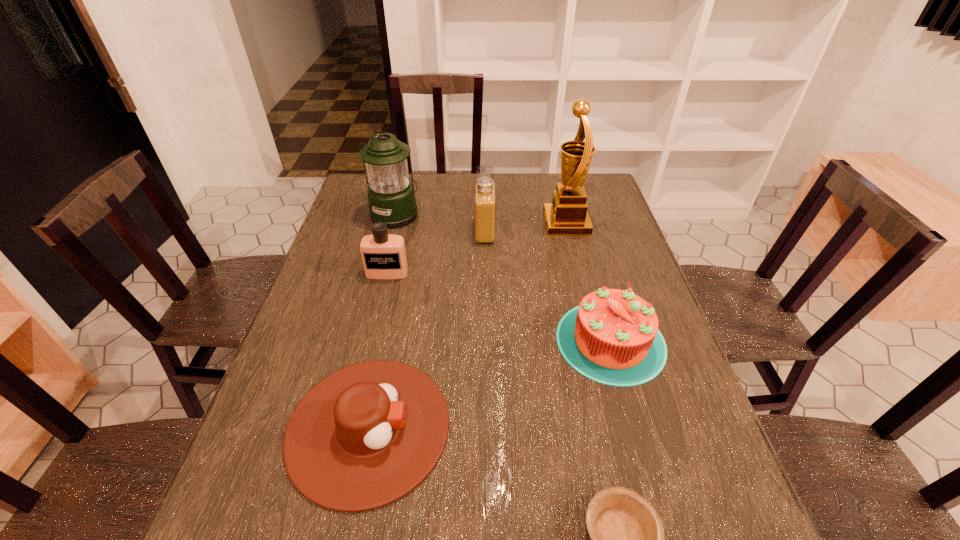
Where is `blank space located on the front-facing side of the tallest object`? This screenshot has height=540, width=960. blank space located on the front-facing side of the tallest object is located at coordinates (438, 223).

The width and height of the screenshot is (960, 540). Identify the location of free space located on the back of the second tallest object. (405, 176).

Where is `free space located on the front-facing side of the taller perfume`? This screenshot has width=960, height=540. free space located on the front-facing side of the taller perfume is located at coordinates (356, 231).

You are a GUI agent. You are given a task and a screenshot of the screen. Output one action in this format:
    pyautogui.click(x=<x>, y=<y>)
    Task: Click on the free spot located 0.300m on the front-facing side of the taller perfume
    
    Given the screenshot: What is the action you would take?
    pyautogui.click(x=381, y=231)

Find the location of a particular element. The width and height of the screenshot is (960, 540). free space located 0.380m on the front-facing side of the taller perfume is located at coordinates (356, 231).

At what (x,y) coordinates should I click in order to perform the action: click on vacant space situated on the front label of the shorter perfume. Please return your answer as a coordinate pair (x, y). The width and height of the screenshot is (960, 540). Looking at the image, I should click on (368, 357).

The height and width of the screenshot is (540, 960). In order to click on free space located 0.370m on the back of the cake in this screenshot , I will do `click(577, 222)`.

Identify the location of free space located 0.340m on the front-facing side of the sixth tallest object. This screenshot has width=960, height=540. coord(614,428).

Locate an element on the screen. This screenshot has width=960, height=540. object at the far edge is located at coordinates (391, 197).

The width and height of the screenshot is (960, 540). I want to click on lantern located in the left edge section of the desktop, so click(391, 197).